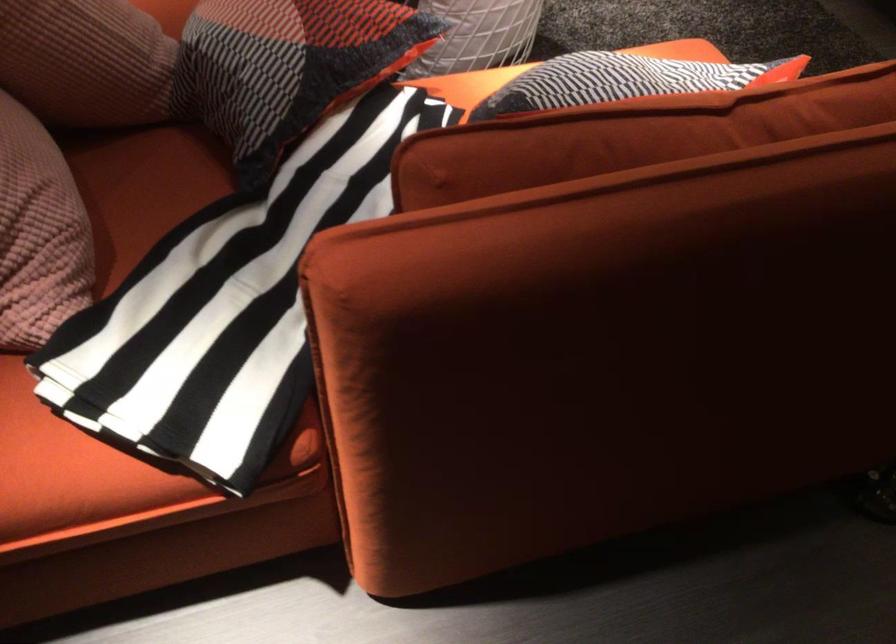
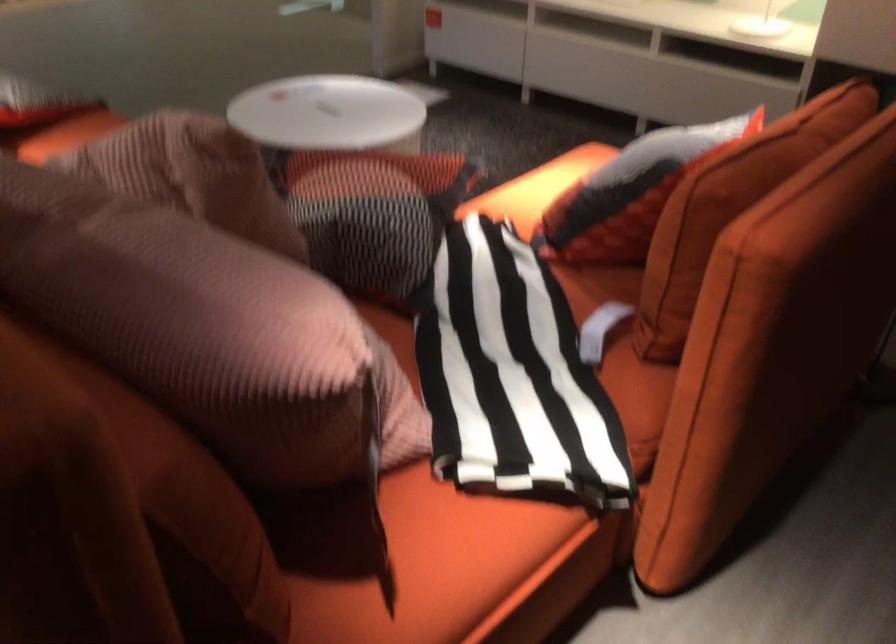
Question: The images are taken continuously from a first-person perspective. In which direction is your viewpoint rotating?

Choices:
 (A) Left
 (B) Right
 (C) Up
 (D) Down

Answer: (B)